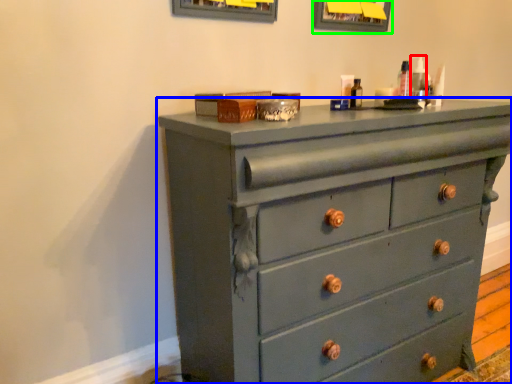
Question: Based on their relative distances, which object is nearer to toiletry (highlighted by a red box)? Choose from chest of drawers (highlighted by a blue box) and picture frame (highlighted by a green box).

Choices:
 (A) chest of drawers
 (B) picture frame

Answer: (B)